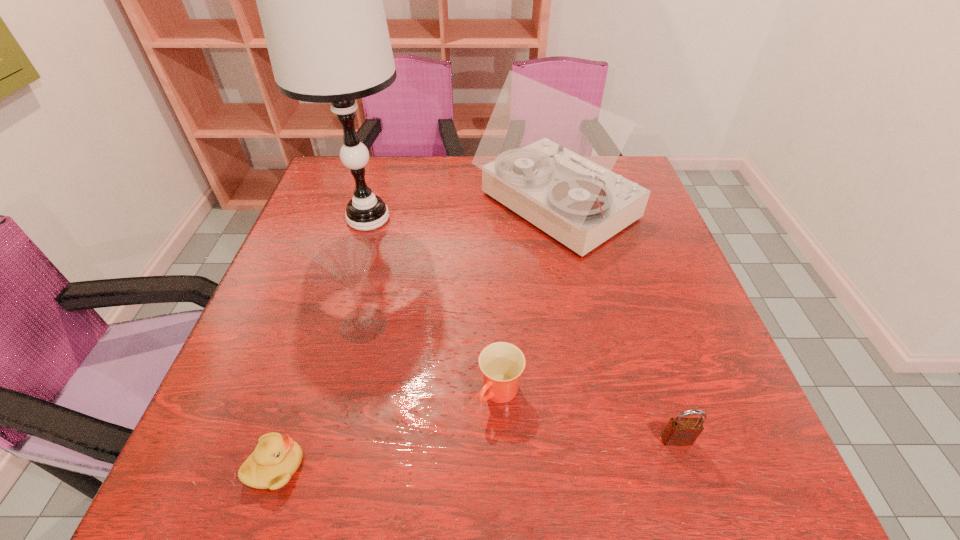
Locate an element on the screen. The image size is (960, 540). unoccupied area between the third tallest object and the third nearest object is located at coordinates (432, 359).

Choose which object is the fifth nearest neighbor to the flute glass. Please provide its 2D coordinates. Your answer should be formatted as a tuple, i.e. [(x, y)], where the tuple contains the x and y coordinates of a point satisfying the conditions above.

[(679, 431)]

I want to click on object that is the fourth closest to the fifth shortest object, so click(679, 431).

The image size is (960, 540). I want to click on vacant space that satisfies the following two spatial constraints: 1. on the back side of the second tallest object; 2. on the left side of the fourth farthest object, so click(x=493, y=208).

The width and height of the screenshot is (960, 540). Find the location of `free space that satisfies the following two spatial constraints: 1. on the front side of the flute glass; 2. on the beak of the duckling`. free space that satisfies the following two spatial constraints: 1. on the front side of the flute glass; 2. on the beak of the duckling is located at coordinates (x=329, y=466).

Find the location of `free space that satisfies the following two spatial constraints: 1. on the back side of the third nearest object; 2. on the left side of the fifth shortest object`. free space that satisfies the following two spatial constraints: 1. on the back side of the third nearest object; 2. on the left side of the fifth shortest object is located at coordinates pyautogui.click(x=493, y=208).